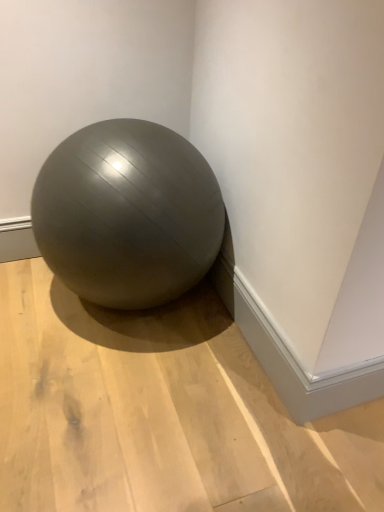
Image resolution: width=384 pixels, height=512 pixels. In order to click on vacant space underneath satin gray ball at center (from a real-world perspective) in this screenshot , I will do `click(132, 319)`.